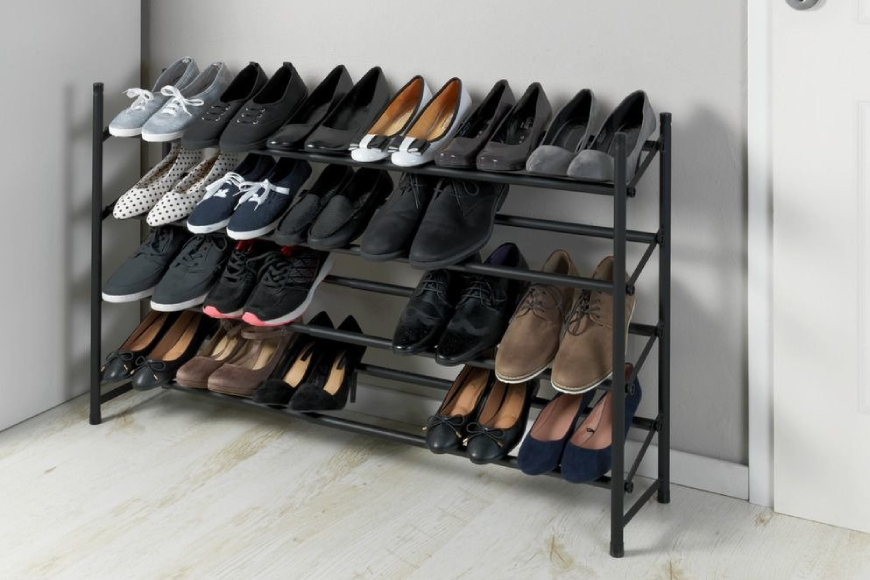
At what (x,y) coordinates should I click in order to perform the action: click on shoes on bottom rack. Please return your answer as a coordinate pair (x, y). Looking at the image, I should click on (126, 358), (162, 364), (188, 371), (235, 376), (291, 379), (335, 383), (446, 416), (492, 431), (544, 431), (598, 444).